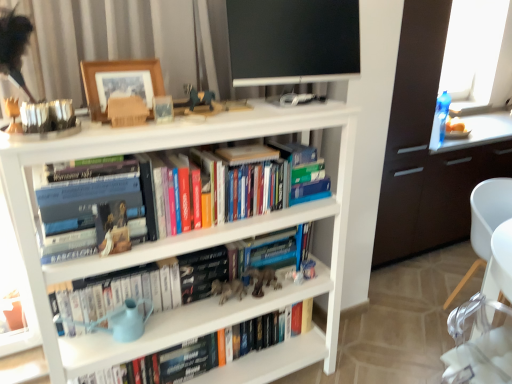
Image resolution: width=512 pixels, height=384 pixels. What are the coordinates of `vacant space behind white plastic chair at lower right` in the screenshot? It's located at (438, 282).